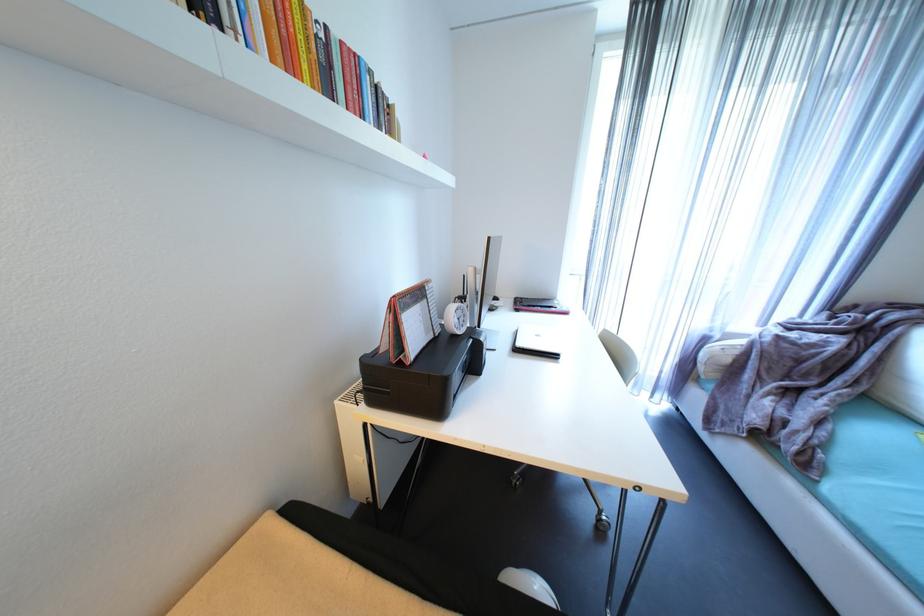
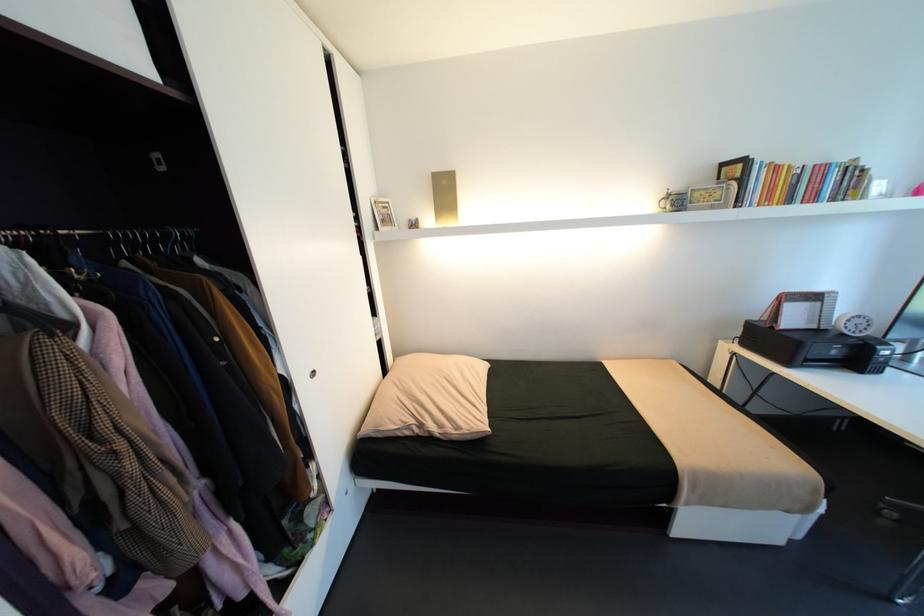
Locate, in the second image, the point that corresponds to pixel 407 363 in the first image.

(779, 328)